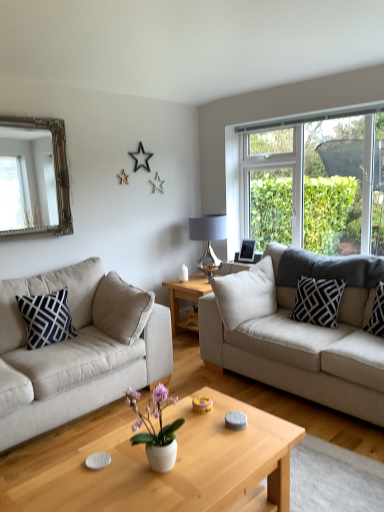
Locate an element on the screen. The height and width of the screenshot is (512, 384). vacant space in silver/gilded mirror at upper left (from a real-world perspective) is located at coordinates (34, 258).